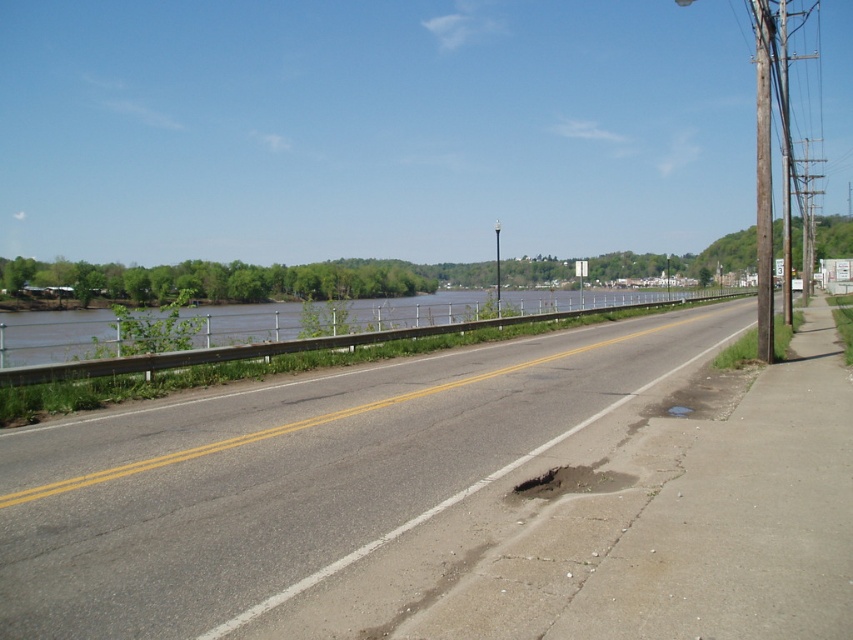
Question: Does asphalt road at center have a smaller size compared to brown water at center?

Choices:
 (A) no
 (B) yes

Answer: (B)

Question: Which point is farther from the camera taking this photo?

Choices:
 (A) (239, 624)
 (B) (498, 292)
 (C) (39, 372)

Answer: (B)

Question: Is asphalt road at center thinner than metallic pole at center?

Choices:
 (A) yes
 (B) no

Answer: (B)

Question: Which point is closer to the camera?

Choices:
 (A) metallic pole at center
 (B) asphalt road at center
 (C) brown water at center

Answer: (B)

Question: Is brown water at center below metallic pole at center?

Choices:
 (A) yes
 (B) no

Answer: (A)

Question: Which object appears closest to the camera in this image?

Choices:
 (A) brown water at center
 (B) asphalt road at center
 (C) metallic pole at center

Answer: (B)